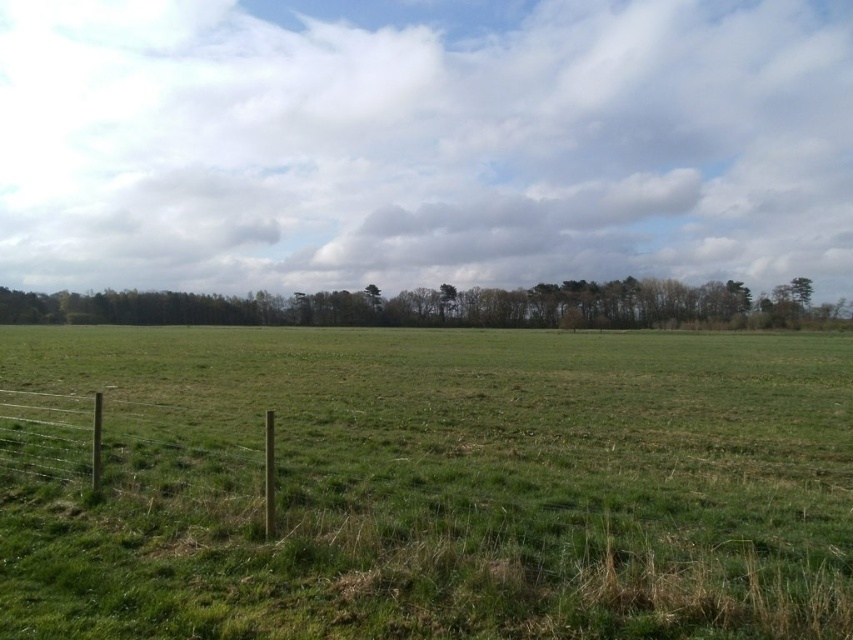
You are a farmer checking the height of your crops and trees. You have a ladder that can reach 2 meters. The green leafy trees at upper center are 5 meters tall. Can you safely reach the top of the green grass pasture at center with your ladder?

The green grass pasture at center is shorter than the green leafy trees at upper center, which are 5 meters tall. Since the grass pasture is shorter than the trees, it is likely under 5 meters. The ladder can reach 2 meters, so if the grass pasture is shorter than 2 meters, the ladder can reach it. However, without exact grass height, we can only confirm it is shorter than 5 meters. The farmer should measure the grass height to determine if the ladder is sufficient.

Based on the photo, you are a farmer checking the field layout. You see the green grass pasture at center and the brown wooden fence at lower left. Which one is positioned more to the east side of the field?

The brown wooden fence at lower left is positioned more to the east side of the field because the green grass pasture at center is to the right of it.

You are standing in the middle of the green grass pasture at center and want to walk towards the green leafy trees at upper center. In which direction should you head?

The green grass pasture at center is to the right of the green leafy trees at upper center, so you should head to the left to reach them.